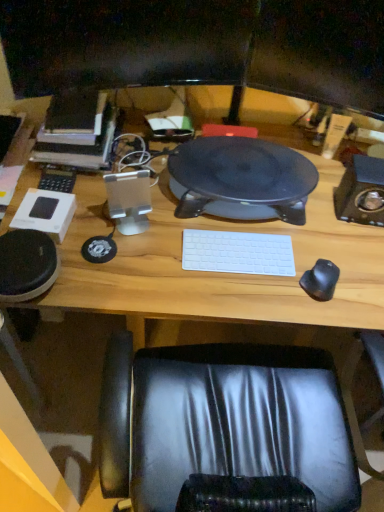
Locate an element on the screen. This screenshot has height=512, width=384. vacant area to the left of black rubber mouse at right is located at coordinates pos(261,292).